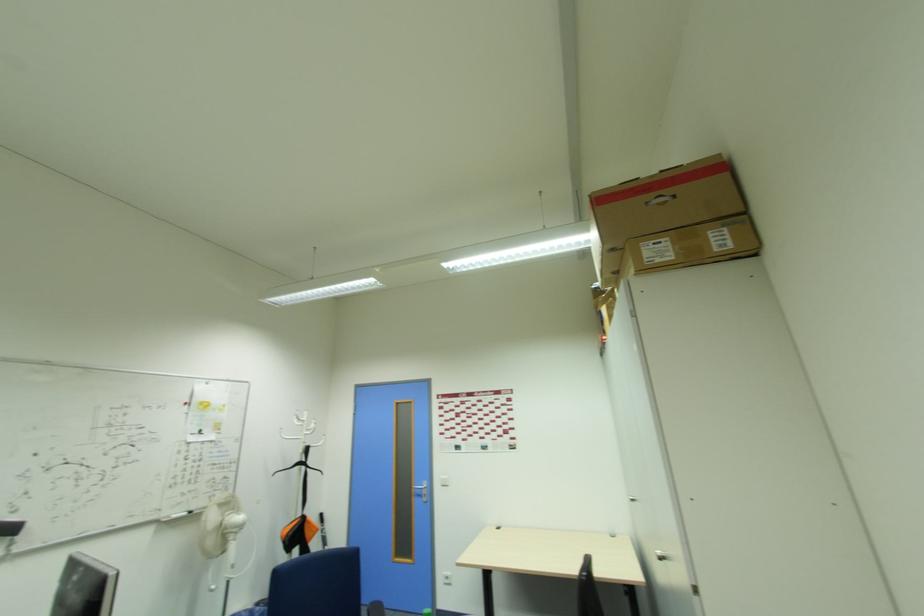
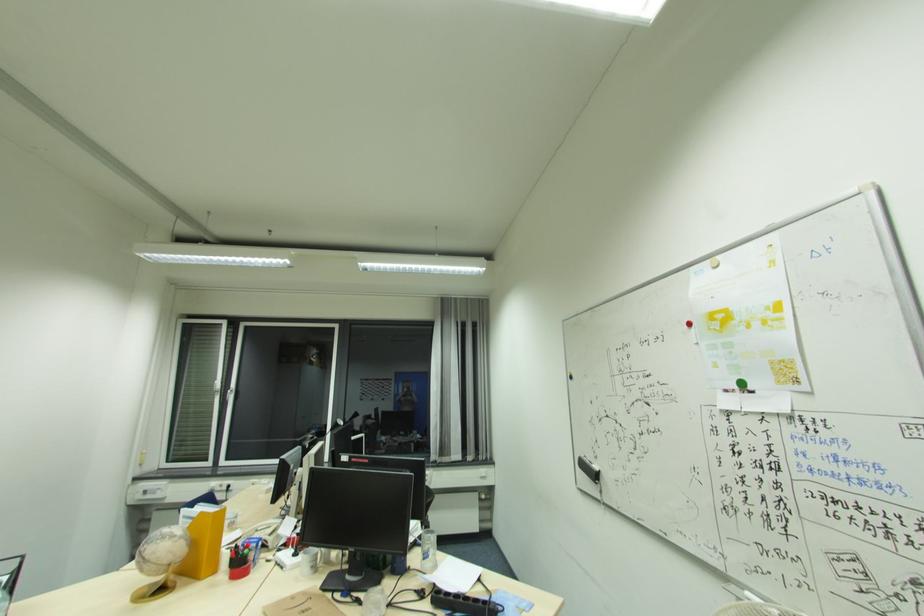
Where in the second image is the point corresponding to [201,434] from the first image?

(739, 387)